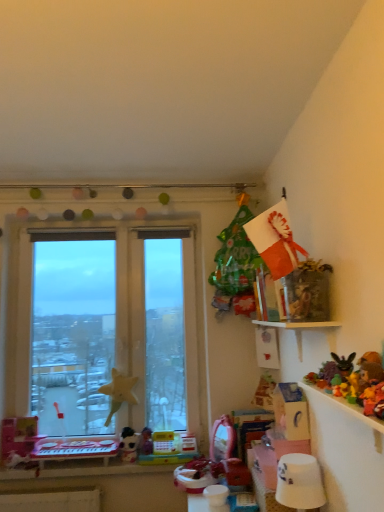
This screenshot has height=512, width=384. I want to click on vacant space situated above white plastic table at lower left (from a real-world perspective), so click(x=79, y=444).